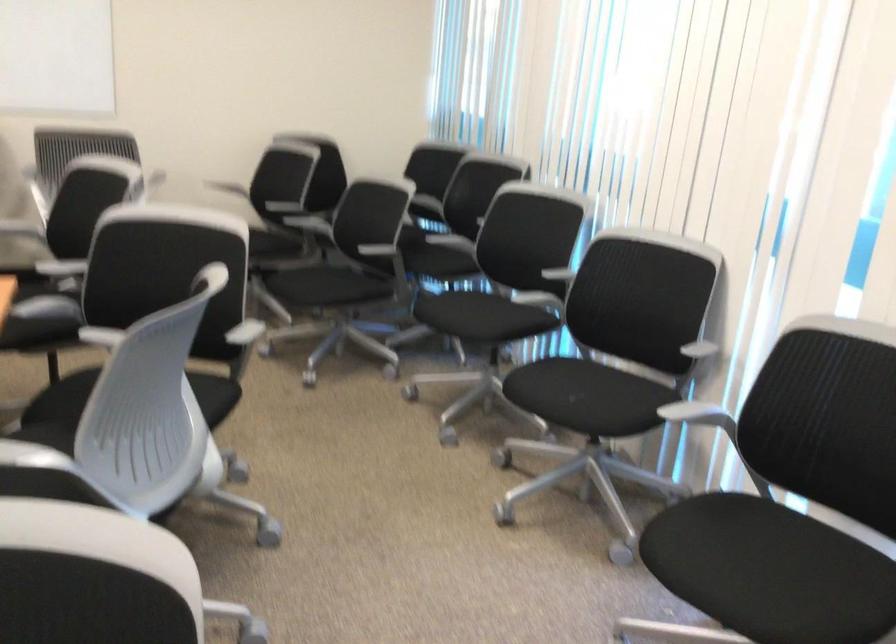
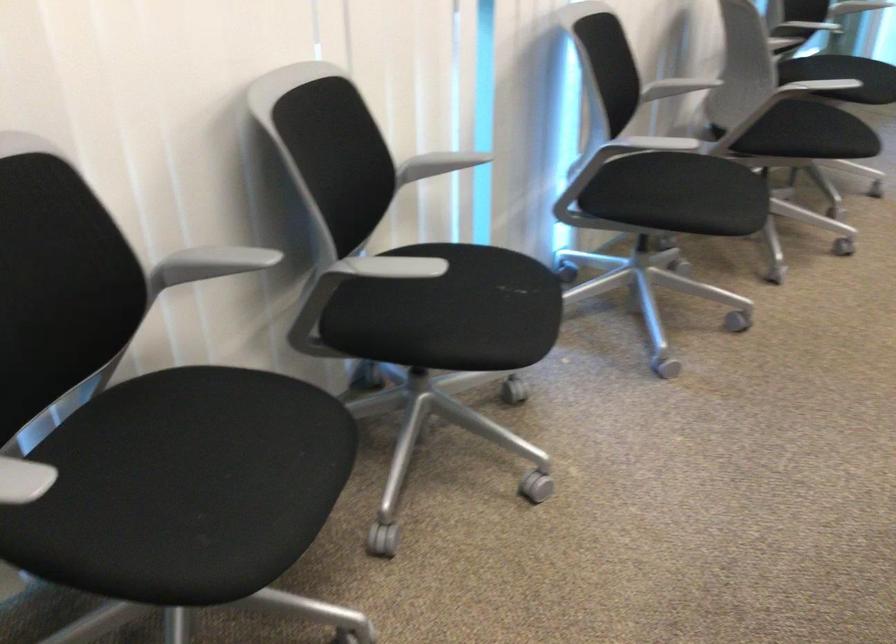
The point at (700, 540) is marked in the first image. Where is the corresponding point in the second image?

(679, 194)